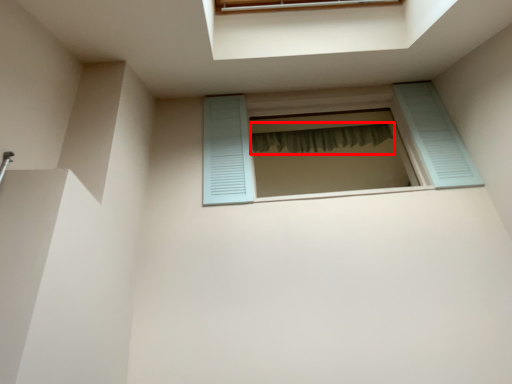
Question: From the image's perspective, what is the correct spatial relationship of shower curtain (annotated by the red box) in relation to window?

Choices:
 (A) below
 (B) above

Answer: (B)